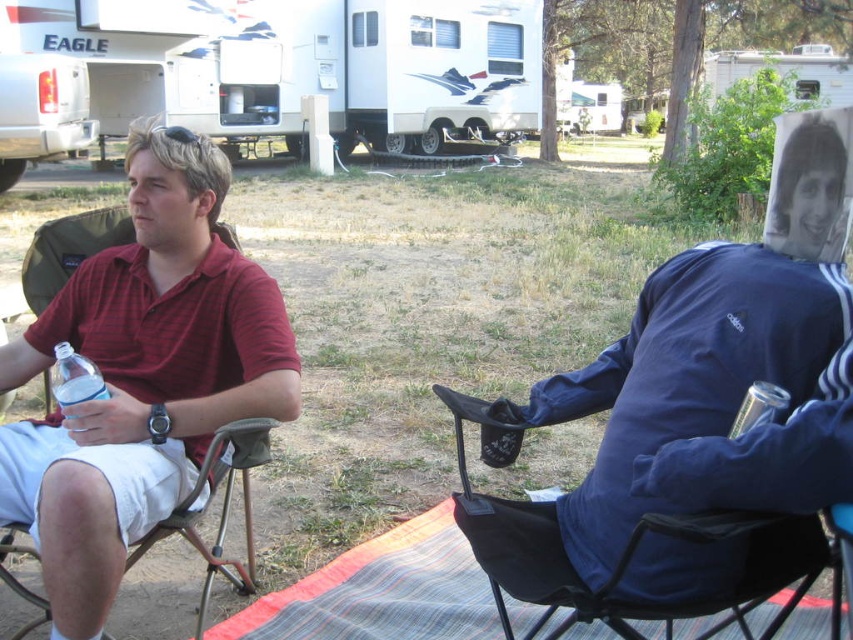
Question: Considering the real-world distances, which object is closest to the matte white rv at upper left?

Choices:
 (A) matte red shirt at left
 (B) clear plastic cup at lower right

Answer: (A)

Question: Which is nearer to the metallic folding chair at left?

Choices:
 (A) white glossy recreational vehicle at upper center
 (B) matte white rv at upper left

Answer: (B)

Question: Among these points, which one is nearest to the camera?

Choices:
 (A) (479, 515)
 (B) (9, 148)

Answer: (A)

Question: Is black fabric chair at right thinner than clear plastic cup at lower right?

Choices:
 (A) yes
 (B) no

Answer: (B)

Question: Is matte red shirt at left wider than white glossy recreational vehicle at upper center?

Choices:
 (A) yes
 (B) no

Answer: (A)

Question: Does white glossy recreational vehicle at upper center appear on the left side of metallic folding chair at left?

Choices:
 (A) yes
 (B) no

Answer: (A)